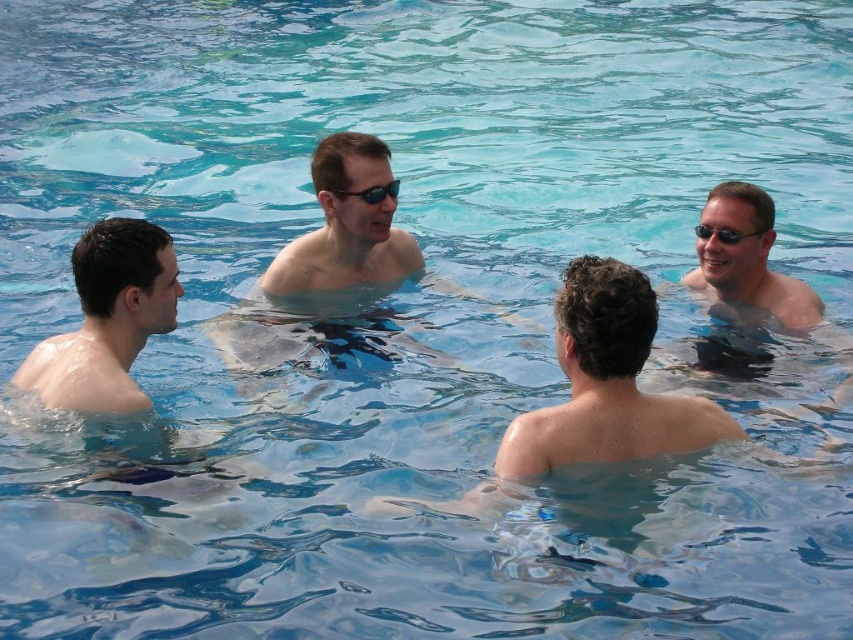
You are a GUI agent. You are given a task and a screenshot of the screen. Output one action in this format:
    pyautogui.click(x=<x>, y=<y>)
    Task: Click on the black plastic sunglasses at center
    This screenshot has height=640, width=853.
    Given the screenshot: What is the action you would take?
    point(372,193)

How much distance is there between smooth skin head at left and matte black swim trunks at right?

smooth skin head at left and matte black swim trunks at right are 7.54 meters apart from each other.

Can you confirm if smooth skin head at left is wider than matte black swim trunks at right?

Yes, smooth skin head at left is wider than matte black swim trunks at right.

Which is behind, point (59, 358) or point (711, 365)?

Point (711, 365)

Identify the location of smooth skin head at left. The width and height of the screenshot is (853, 640). (107, 320).

Between matte skin at center and smooth skin head at left, which one appears on the right side from the viewer's perspective?

matte skin at center is more to the right.

Measure the distance between matte skin at center and smooth skin head at left.

A distance of 3.62 meters exists between matte skin at center and smooth skin head at left.

Is point (302, 292) closer to camera compared to point (100, 404)?

No, it is behind (100, 404).

Locate an element on the screen. The height and width of the screenshot is (640, 853). matte skin at center is located at coordinates (325, 260).